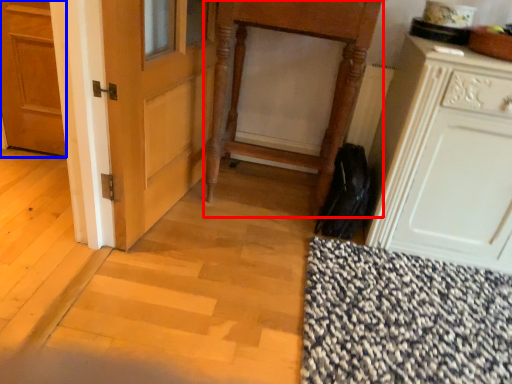
Question: Which object appears closest to the camera in this image, vanity (highlighted by a red box) or door (highlighted by a blue box)?

Choices:
 (A) vanity
 (B) door

Answer: (A)